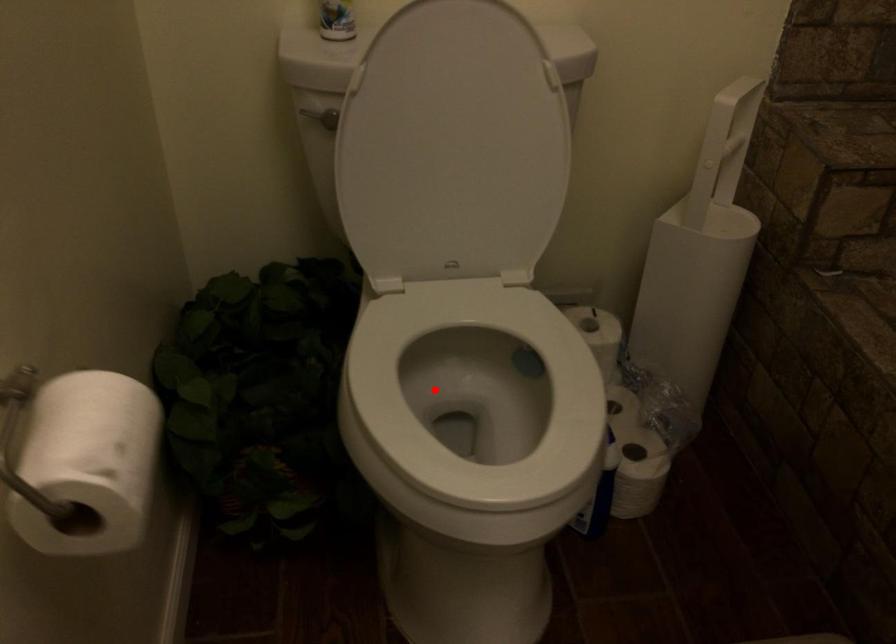
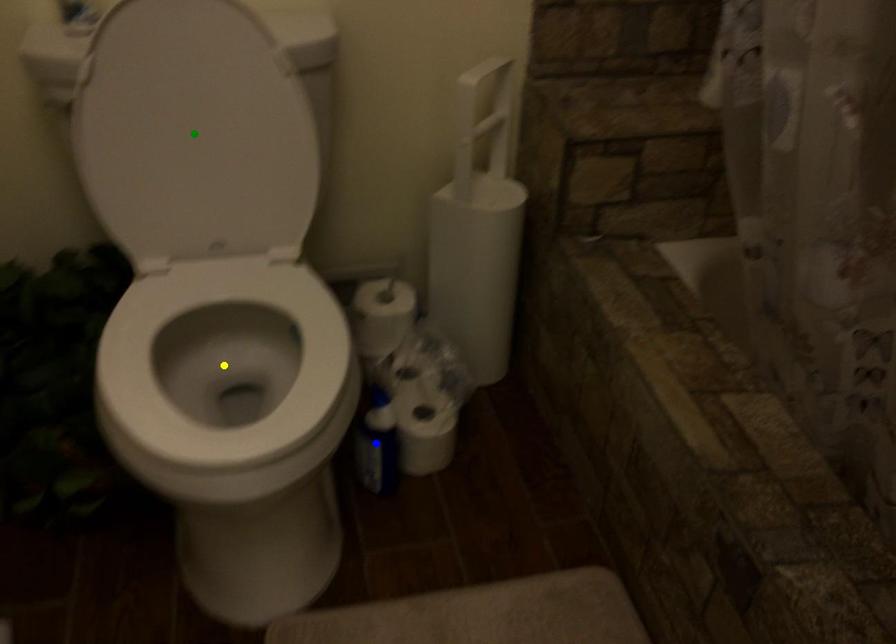
Question: I am providing you with two images of the same scene from different viewpoints. A red point is marked on the first image. You are given multiple points on the second image. Can you choose the point in image 2 that corresponds to the point in image 1?

Choices:
 (A) blue point
 (B) green point
 (C) yellow point

Answer: (C)